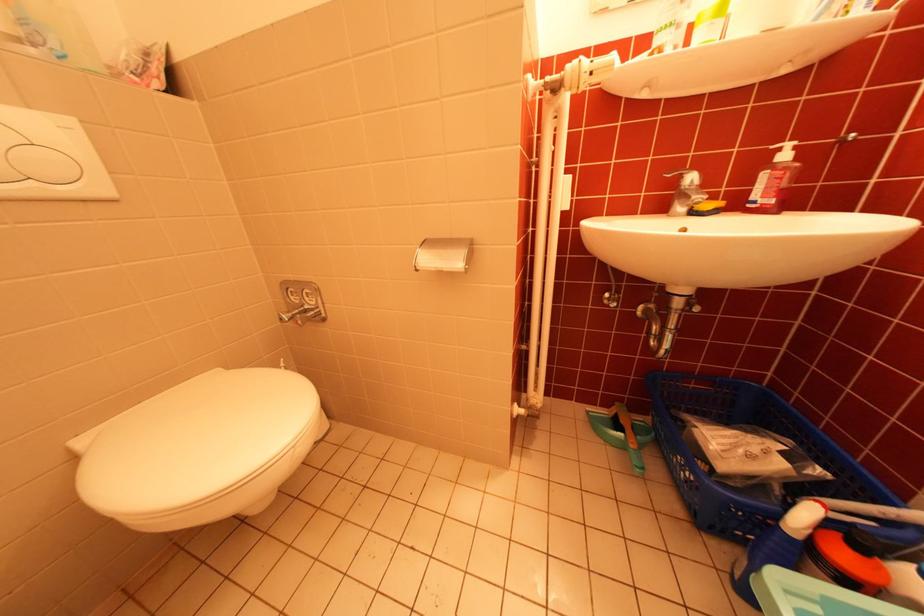
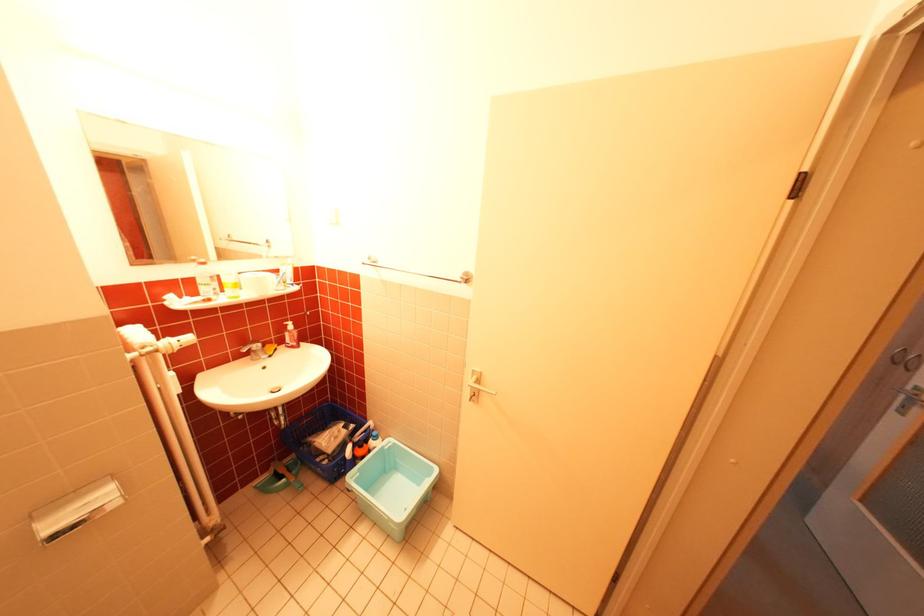
Find the pixel in the second image that matches (x=767, y=198) in the first image.

(298, 342)